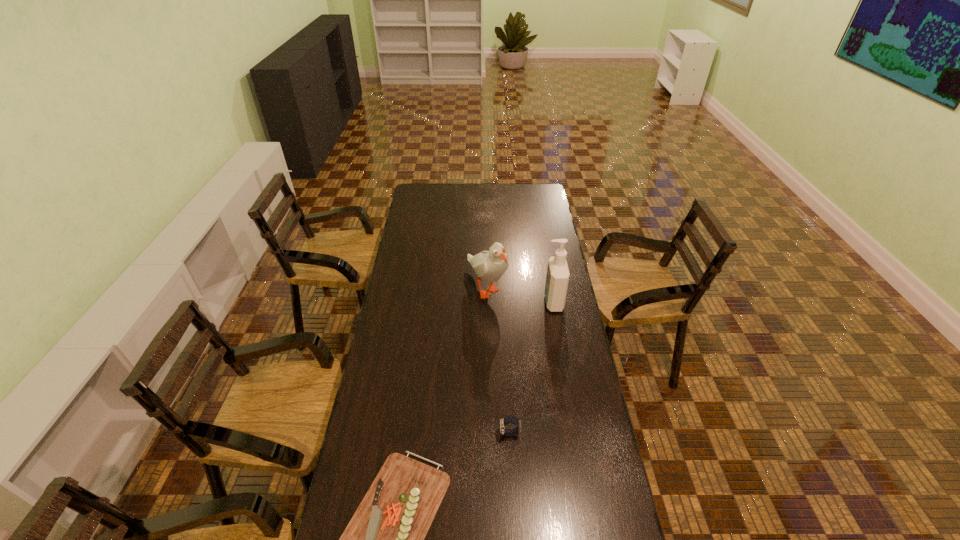
This screenshot has width=960, height=540. Identify the location of free space that is in between the third farthest object and the gull. (498, 360).

You are a GUI agent. You are given a task and a screenshot of the screen. Output one action in this format:
    pyautogui.click(x=<x>, y=<y>)
    Task: Click on the free point between the third tallest object and the gull
    This screenshot has height=540, width=960.
    Given the screenshot: What is the action you would take?
    pyautogui.click(x=498, y=360)

What are the coordinates of `object that is the closest one to the third tallest object` in the screenshot? It's located at (385, 539).

This screenshot has width=960, height=540. Identify the location of the closest object relative to the cleansing agent. (490, 265).